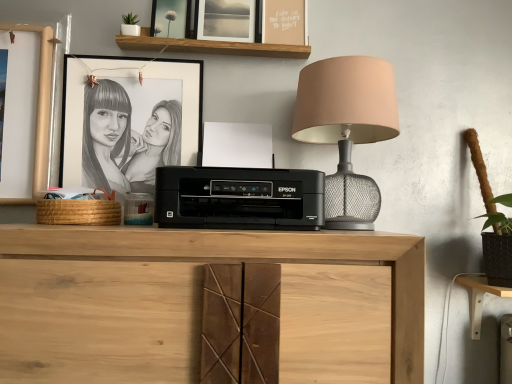
I want to click on white matte picture frame at upper center, the first picture frame viewed from the top, so click(x=225, y=20).

What do you see at coordinates (79, 212) in the screenshot? This screenshot has height=384, width=512. I see `brown woven basket at left` at bounding box center [79, 212].

What are the coordinates of `wooden at upper center` in the screenshot? It's located at (212, 46).

At what (x,y) coordinates should I click in order to perform the action: click on natural wood cabinet at center. Please return your answer as a coordinate pair (x, y). This screenshot has height=384, width=512. Looking at the image, I should click on (201, 303).

I want to click on white matte picture frame at upper center, acting as the third picture frame starting from the bottom, so click(225, 20).

Which is more to the right, white matte picture frame at upper center, acting as the third picture frame starting from the bottom, or natural wood cabinet at center?

From the viewer's perspective, white matte picture frame at upper center, acting as the third picture frame starting from the bottom, appears more on the right side.

The width and height of the screenshot is (512, 384). In order to click on the chest of drawers below the white matte picture frame at upper center, the first picture frame viewed from the top (from the image's perspective) in this screenshot , I will do tap(201, 303).

From a real-world perspective, does natural wood cabinet at center stand above brown woven basket at left?

No, from a real-world perspective, natural wood cabinet at center is not over brown woven basket at left

Is natural wood cabinet at center at the right side of brown woven basket at left?

Yes, natural wood cabinet at center is to the right of brown woven basket at left.

Can you see natural wood cabinet at center touching brown woven basket at left?

They are not placed beside each other.

How different are the orientations of natural wood cabinet at center and brown woven basket at left in degrees?

The facing directions of natural wood cabinet at center and brown woven basket at left are 2.95 degrees apart.

Is wooden at upper center positioned beyond the bounds of brown woven basket at left?

wooden at upper center lies outside brown woven basket at left's area.

Which object is positioned more to the left, wooden at upper center or brown woven basket at left?

brown woven basket at left is more to the left.

From a real-world perspective, is wooden at upper center physically above brown woven basket at left?

Correct, in the physical world, wooden at upper center is higher than brown woven basket at left.

Is wooden at upper center oriented away from brown woven basket at left?

wooden at upper center is not turned away from brown woven basket at left.

This screenshot has width=512, height=384. I want to click on basket on the left of black plastic printer at center, so click(x=79, y=212).

Is point (82, 224) more distant than point (316, 197)?

Yes, it is behind point (316, 197).

From a real-world perspective, does brown woven basket at left stand above black plastic printer at center?

No, from a real-world perspective, brown woven basket at left is not above black plastic printer at center.

Is matte gray lampshade at upper right beside natural wood cabinet at center?

No, matte gray lampshade at upper right is not next to natural wood cabinet at center.

Based on the photo, is matte gray lampshade at upper right aimed at natural wood cabinet at center?

No.

The image size is (512, 384). Find the location of `lamp above the natural wood cabinet at center (from a real-world perspective)`. lamp above the natural wood cabinet at center (from a real-world perspective) is located at coordinates (347, 129).

From a real-world perspective, does matte gray lampshade at upper right sit lower than natural wood cabinet at center?

Actually, matte gray lampshade at upper right is physically above natural wood cabinet at center in the real world.

From a real-world perspective, between black paper picture frame at upper left, the 1th picture frame ordered from the bottom, and light wood computer desk at lower right, who is vertically lower?

light wood computer desk at lower right is physically lower.

Is the depth of black paper picture frame at upper left, the third picture frame when ordered from top to bottom, less than that of light wood computer desk at lower right?

No, the depth of black paper picture frame at upper left, the third picture frame when ordered from top to bottom, is greater than that of light wood computer desk at lower right.

Considering the sizes of black paper picture frame at upper left, the 1th picture frame ordered from the bottom, and light wood computer desk at lower right in the image, is black paper picture frame at upper left, the 1th picture frame ordered from the bottom, taller or shorter than light wood computer desk at lower right?

Clearly, black paper picture frame at upper left, the 1th picture frame ordered from the bottom, is taller compared to light wood computer desk at lower right.

Are black paper picture frame at upper left, the 1th picture frame ordered from the bottom, and light wood computer desk at lower right beside each other?

No, black paper picture frame at upper left, the 1th picture frame ordered from the bottom, is not making contact with light wood computer desk at lower right.

Is brown woven basket at left next to natural wood cabinet at center and touching it?

brown woven basket at left and natural wood cabinet at center are not in contact.

In the image, is brown woven basket at left positioned in front of or behind natural wood cabinet at center?

In the image, brown woven basket at left appears behind natural wood cabinet at center.

From the image's perspective, who appears lower, brown woven basket at left or natural wood cabinet at center?

From the image's view, natural wood cabinet at center is below.

Is brown woven basket at left thinner than natural wood cabinet at center?

Correct, the width of brown woven basket at left is less than that of natural wood cabinet at center.

From the image's perspective, starting from the natural wood cabinet at center, which picture frame is the 3rd one above? Please provide its 2D coordinates.

[(225, 20)]

Where is `basket that appears above the natural wood cabinet at center (from a real-world perspective)`? The height and width of the screenshot is (384, 512). basket that appears above the natural wood cabinet at center (from a real-world perspective) is located at coordinates (79, 212).

Estimate the real-world distances between objects in this image. Which object is further from white matte picture frame at upper center, the first picture frame viewed from the top, wooden at upper center or matte glass picture frame at upper center, which is counted as the 2th picture frame, starting from the bottom?

matte glass picture frame at upper center, which is counted as the 2th picture frame, starting from the bottom, lies further to white matte picture frame at upper center, the first picture frame viewed from the top, than the other object.

Which object lies further to the anchor point black paper picture frame at upper left, the third picture frame when ordered from top to bottom, wooden at upper center or matte glass picture frame at upper center, which is counted as the 2th picture frame, starting from the bottom?

Among the two, matte glass picture frame at upper center, which is counted as the 2th picture frame, starting from the bottom, is located further to black paper picture frame at upper left, the third picture frame when ordered from top to bottom.

Looking at the image, which one is located further to wooden at upper center, brown woven basket at left or black paper picture frame at upper left, the third picture frame when ordered from top to bottom?

Among the two, brown woven basket at left is located further to wooden at upper center.

Which object lies further to the anchor point white matte picture frame at upper center, the first picture frame viewed from the top, black paper picture frame at upper left, the 1th picture frame ordered from the bottom, or brown woven basket at left?

Based on the image, brown woven basket at left appears to be further to white matte picture frame at upper center, the first picture frame viewed from the top.

When comparing their distances from matte gray lampshade at upper right, does light wood computer desk at lower right or matte glass picture frame at upper center, which is counted as the 2th picture frame, starting from the bottom, seem further?

light wood computer desk at lower right is positioned further to the anchor matte gray lampshade at upper right.

Which object lies further to the anchor point matte glass picture frame at upper center, which is counted as the 2th picture frame, starting from the bottom, matte gray lampshade at upper right or white matte picture frame at upper center, acting as the third picture frame starting from the bottom?

matte gray lampshade at upper right is further to matte glass picture frame at upper center, which is counted as the 2th picture frame, starting from the bottom.

Based on their spatial positions, is black paper picture frame at upper left, the third picture frame when ordered from top to bottom, or wooden at upper center closer to matte glass picture frame at upper center, which is counted as the 2th picture frame, starting from the bottom?

wooden at upper center is positioned closer to the anchor matte glass picture frame at upper center, which is counted as the 2th picture frame, starting from the bottom.

From the image, which object appears to be farther from matte gray lampshade at upper right, matte glass picture frame at upper center, acting as the second picture frame starting from the top, or white matte picture frame at upper center, the first picture frame viewed from the top?

Based on the image, matte glass picture frame at upper center, acting as the second picture frame starting from the top, appears to be further to matte gray lampshade at upper right.

Where is `chest of drawers between brown woven basket at left and black plastic printer at center in the horizontal direction`? chest of drawers between brown woven basket at left and black plastic printer at center in the horizontal direction is located at coordinates (201, 303).

Where is `shelf between matte glass picture frame at upper center, acting as the second picture frame starting from the top, and natural wood cabinet at center in the up-down direction`? The width and height of the screenshot is (512, 384). shelf between matte glass picture frame at upper center, acting as the second picture frame starting from the top, and natural wood cabinet at center in the up-down direction is located at coordinates point(212,46).

The width and height of the screenshot is (512, 384). I want to click on basket that lies between wooden at upper center and natural wood cabinet at center from top to bottom, so click(x=79, y=212).

Where is `printer situated between black paper picture frame at upper left, the third picture frame when ordered from top to bottom, and matte gray lampshade at upper right from left to right`? The image size is (512, 384). printer situated between black paper picture frame at upper left, the third picture frame when ordered from top to bottom, and matte gray lampshade at upper right from left to right is located at coordinates (239, 198).